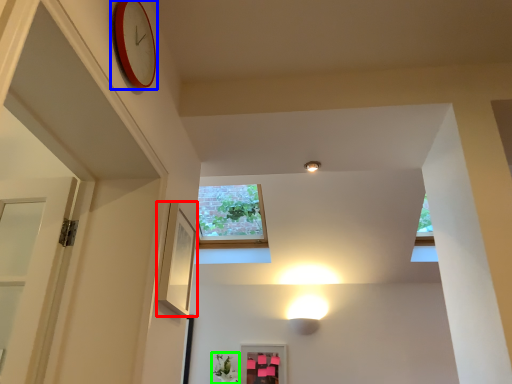
Question: Which object is positioned farthest from picture frame (highlighted by a red box)? Select from clock (highlighted by a blue box) and plant (highlighted by a green box).

Choices:
 (A) clock
 (B) plant

Answer: (B)